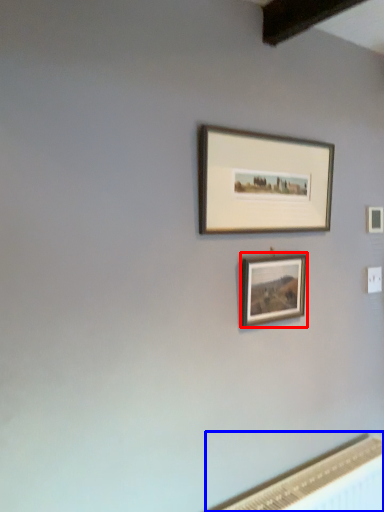
Question: Which point is further to the camera, picture frame (highlighted by a red box) or radiator (highlighted by a blue box)?

Choices:
 (A) picture frame
 (B) radiator

Answer: (A)